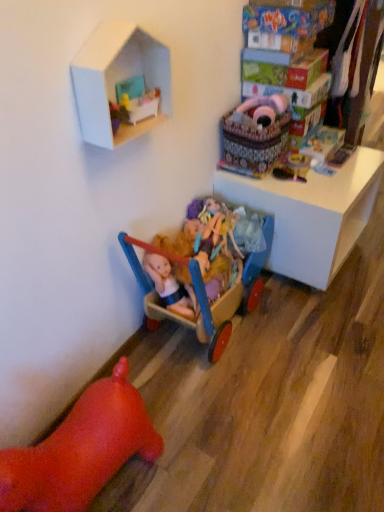
The width and height of the screenshot is (384, 512). Identify the location of free location to the right of wooden toy car at upper right, which ranks as the seventh toy in left-to-right order. (365, 155).